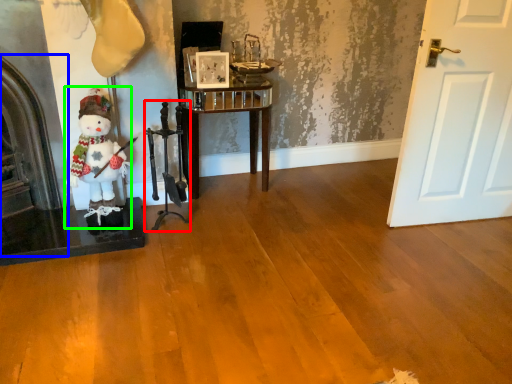
Question: Considering the real-world distances, which object is farthest from chair (highlighted by a red box)? fireplace (highlighted by a blue box) or figurine (highlighted by a green box)?

Choices:
 (A) fireplace
 (B) figurine

Answer: (A)